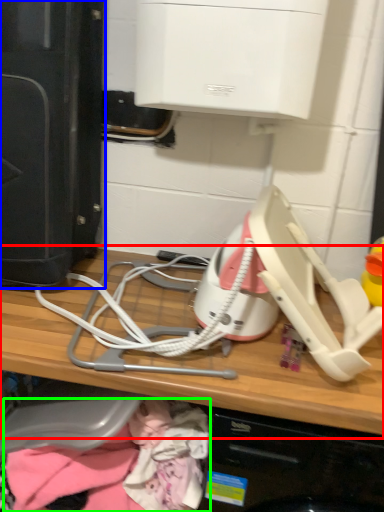
Question: Considering the real-world distances, which object is farthest from computer (highlighted by a red box)? home appliance (highlighted by a blue box) or clothing (highlighted by a green box)?

Choices:
 (A) home appliance
 (B) clothing

Answer: (A)